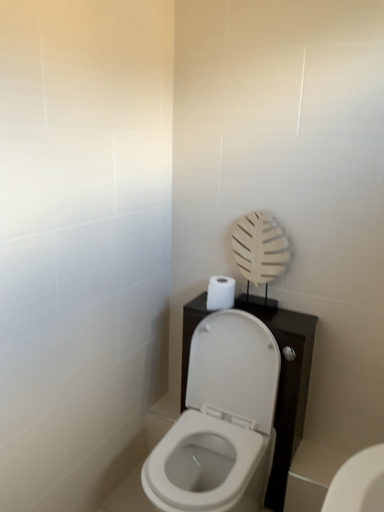
Measure the distance between point (x=172, y=494) and camera.

A distance of 1.35 meters exists between point (x=172, y=494) and camera.

The height and width of the screenshot is (512, 384). Describe the element at coordinates (358, 483) in the screenshot. I see `white glossy toilet at lower right, arranged as the first toilet when ordered from the bottom` at that location.

Locate an element on the screen. This screenshot has height=512, width=384. white glossy toilet at center, the second toilet positioned from the bottom is located at coordinates (220, 421).

Can you tell me how much white glossy toilet at lower right, positioned as the 2th toilet in left-to-right order, and white glossy toilet at center, which ranks as the first toilet in left-to-right order, differ in facing direction?

0.245 degrees.

Does white glossy toilet at lower right, positioned as the 2th toilet in left-to-right order, have a greater height compared to white glossy toilet at center, placed as the first toilet when sorted from top to bottom?

In fact, white glossy toilet at lower right, positioned as the 2th toilet in left-to-right order, may be shorter than white glossy toilet at center, placed as the first toilet when sorted from top to bottom.

Based on the photo, is white glossy toilet at lower right, the first toilet when ordered from right to left, in front of white glossy toilet at center, positioned as the 2th toilet in right-to-left order?

No, white glossy toilet at lower right, the first toilet when ordered from right to left, is further to the viewer.

From a real-world perspective, which object stands above the other?

white glossy toilet at center, which ranks as the first toilet in left-to-right order.

Locate an element on the screen. The width and height of the screenshot is (384, 512). the 1st toilet below when counting from the white matte toilet paper at upper right (from the image's perspective) is located at coordinates (220, 421).

Which object is closer to the camera taking this photo, white matte toilet paper at upper right or white glossy toilet at center, which ranks as the first toilet in left-to-right order?

white glossy toilet at center, which ranks as the first toilet in left-to-right order, is more forward.

Which is less distant, (224, 294) or (209, 357)?

Positioned in front is point (224, 294).

Which is farther, (x=221, y=300) or (x=345, y=502)?

The point (x=221, y=300) is farther from the camera.

Who is taller, white matte toilet paper at upper right or white glossy toilet at lower right, the first toilet when ordered from right to left?

With more height is white matte toilet paper at upper right.

Is white matte toilet paper at upper right thinner than white glossy toilet at lower right, positioned as the 2th toilet in left-to-right order?

Indeed, white matte toilet paper at upper right has a lesser width compared to white glossy toilet at lower right, positioned as the 2th toilet in left-to-right order.

Is white glossy toilet at lower right, the first toilet when ordered from right to left, inside or outside of white matte toilet paper at upper right?

white glossy toilet at lower right, the first toilet when ordered from right to left, is not enclosed by white matte toilet paper at upper right.

Is white glossy toilet at lower right, the first toilet when ordered from right to left, bigger than white matte toilet paper at upper right?

No.

Considering the positions of objects white glossy toilet at lower right, arranged as the first toilet when ordered from the bottom, and white matte toilet paper at upper right in the image provided, who is more to the left, white glossy toilet at lower right, arranged as the first toilet when ordered from the bottom, or white matte toilet paper at upper right?

white matte toilet paper at upper right is more to the left.

Could you tell me if white glossy toilet at center, placed as the first toilet when sorted from top to bottom, is turned towards white glossy toilet at lower right, positioned as the 2th toilet in left-to-right order?

No, white glossy toilet at center, placed as the first toilet when sorted from top to bottom, is not facing towards white glossy toilet at lower right, positioned as the 2th toilet in left-to-right order.

Which of these two, white glossy toilet at center, the second toilet positioned from the bottom, or white glossy toilet at lower right, arranged as the first toilet when ordered from the bottom, is wider?

white glossy toilet at center, the second toilet positioned from the bottom.

Who is shorter, white glossy toilet at center, placed as the first toilet when sorted from top to bottom, or white glossy toilet at lower right, arranged as the first toilet when ordered from the bottom?

With less height is white glossy toilet at lower right, arranged as the first toilet when ordered from the bottom.

Is white glossy toilet at center, which ranks as the first toilet in left-to-right order, to the right of white matte toilet paper at upper right from the viewer's perspective?

No, white glossy toilet at center, which ranks as the first toilet in left-to-right order, is not to the right of white matte toilet paper at upper right.

The width and height of the screenshot is (384, 512). In order to click on the 2nd toilet in front of the white matte toilet paper at upper right, starting your count from the anchor in this screenshot , I will do `click(220, 421)`.

From a real-world perspective, is white glossy toilet at center, positioned as the 2th toilet in right-to-left order, above or below white matte toilet paper at upper right?

From a real-world perspective, white glossy toilet at center, positioned as the 2th toilet in right-to-left order, is physically below white matte toilet paper at upper right.

Is white glossy toilet at center, placed as the first toilet when sorted from top to bottom, thinner than white matte toilet paper at upper right?

Incorrect, the width of white glossy toilet at center, placed as the first toilet when sorted from top to bottom, is not less than that of white matte toilet paper at upper right.

You are a GUI agent. You are given a task and a screenshot of the screen. Output one action in this format:
    pyautogui.click(x=<x>, y=<y>)
    Task: Click on the toilet located above the white glossy toilet at lower right, the first toilet when ordered from right to left (from the image's perspective)
    The width and height of the screenshot is (384, 512).
    Given the screenshot: What is the action you would take?
    pyautogui.click(x=220, y=421)

Where is `the 2nd toilet in front of the white matte toilet paper at upper right, starting your count from the anchor`? the 2nd toilet in front of the white matte toilet paper at upper right, starting your count from the anchor is located at coordinates (220, 421).

Which object lies further to the anchor point white glossy toilet at lower right, the first toilet when ordered from right to left, white matte toilet paper at upper right or white glossy toilet at center, the second toilet positioned from the bottom?

Among the two, white matte toilet paper at upper right is located further to white glossy toilet at lower right, the first toilet when ordered from right to left.

Looking at the image, which one is located further to white glossy toilet at center, which ranks as the first toilet in left-to-right order, white glossy toilet at lower right, the first toilet when ordered from right to left, or white matte toilet paper at upper right?

Among the two, white glossy toilet at lower right, the first toilet when ordered from right to left, is located further to white glossy toilet at center, which ranks as the first toilet in left-to-right order.

From the image, which object appears to be nearer to white glossy toilet at lower right, the first toilet when ordered from right to left, white glossy toilet at center, which ranks as the first toilet in left-to-right order, or white matte toilet paper at upper right?

white glossy toilet at center, which ranks as the first toilet in left-to-right order, is positioned closer to the anchor white glossy toilet at lower right, the first toilet when ordered from right to left.

Looking at the image, which one is located further to white matte toilet paper at upper right, white glossy toilet at center, placed as the first toilet when sorted from top to bottom, or white glossy toilet at lower right, arranged as the first toilet when ordered from the bottom?

Among the two, white glossy toilet at lower right, arranged as the first toilet when ordered from the bottom, is located further to white matte toilet paper at upper right.

Which object lies further to the anchor point white glossy toilet at center, placed as the first toilet when sorted from top to bottom, white matte toilet paper at upper right or white glossy toilet at lower right, arranged as the first toilet when ordered from the bottom?

white glossy toilet at lower right, arranged as the first toilet when ordered from the bottom, lies further to white glossy toilet at center, placed as the first toilet when sorted from top to bottom, than the other object.

Based on their spatial positions, is white glossy toilet at lower right, arranged as the first toilet when ordered from the bottom, or white glossy toilet at center, which ranks as the first toilet in left-to-right order, closer to white matte toilet paper at upper right?

white glossy toilet at center, which ranks as the first toilet in left-to-right order, is positioned closer to the anchor white matte toilet paper at upper right.

You are a GUI agent. You are given a task and a screenshot of the screen. Output one action in this format:
    pyautogui.click(x=<x>, y=<y>)
    Task: Click on the toilet between white matte toilet paper at upper right and white glossy toilet at lower right, the first toilet when ordered from right to left, in the vertical direction
    This screenshot has height=512, width=384.
    Given the screenshot: What is the action you would take?
    pyautogui.click(x=220, y=421)